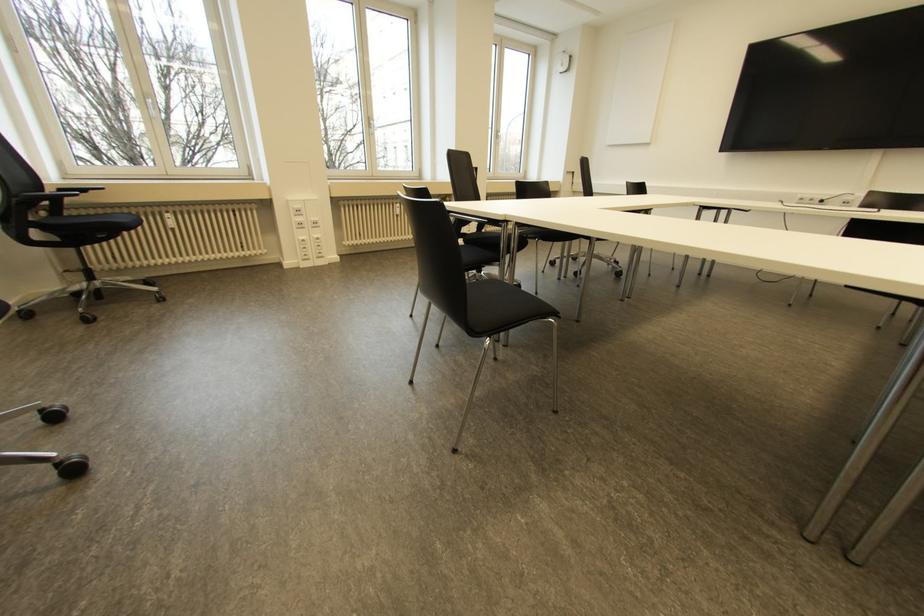
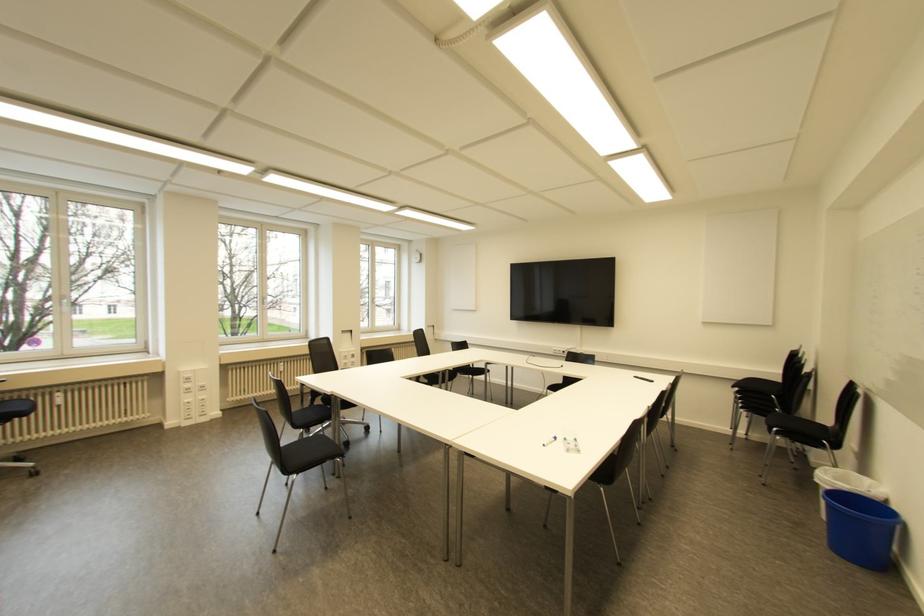
The point at (553, 314) is marked in the first image. Where is the corresponding point in the second image?

(342, 455)